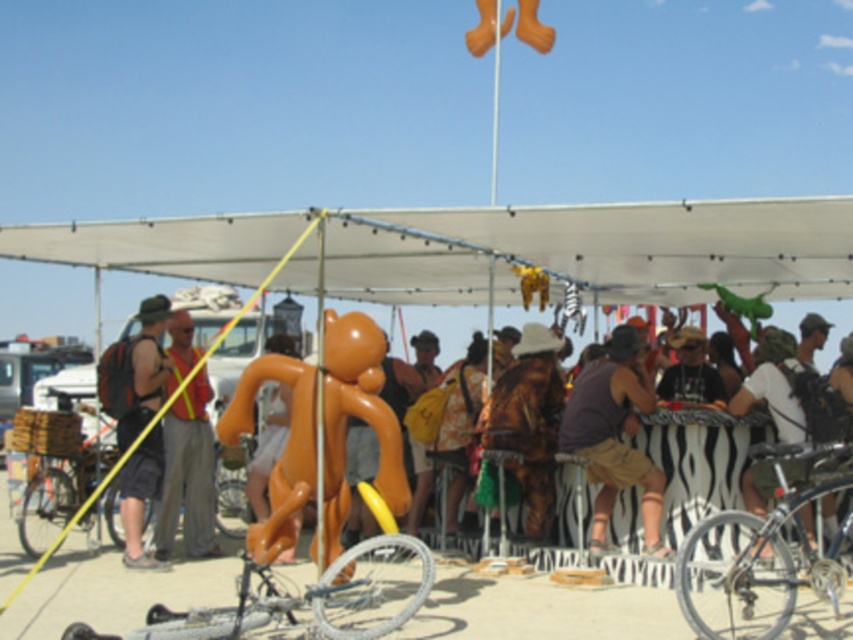
You are at a festival and want to take a photo of the orange rubber monkey at center and the white matte bicycle at right. Which object will appear larger in your photo?

The orange rubber monkey at center will appear larger in the photo because it is bigger than the white matte bicycle at right.

Looking at this image, you are organizing a small fair and need to place a 1.2 meter wide banner between the silver metallic bicycle at lower right and the matte brown hat at center. Can the space between them accommodate the banner?

Answer: The silver metallic bicycle at lower right is wider than the matte brown hat at center. However, the exact distance between them isn

You are setting up a temporary art exhibit and need to place the orange rubber monkey at center and the white matte bicycle at right in a space that is 1.5 meters wide. Based on their widths, will both items fit side by side within this space?

The orange rubber monkey at center might be wider than the white matte bicycle at right, so there is uncertainty whether both will fit within the 1.5 meters. Measure their exact widths to confirm.